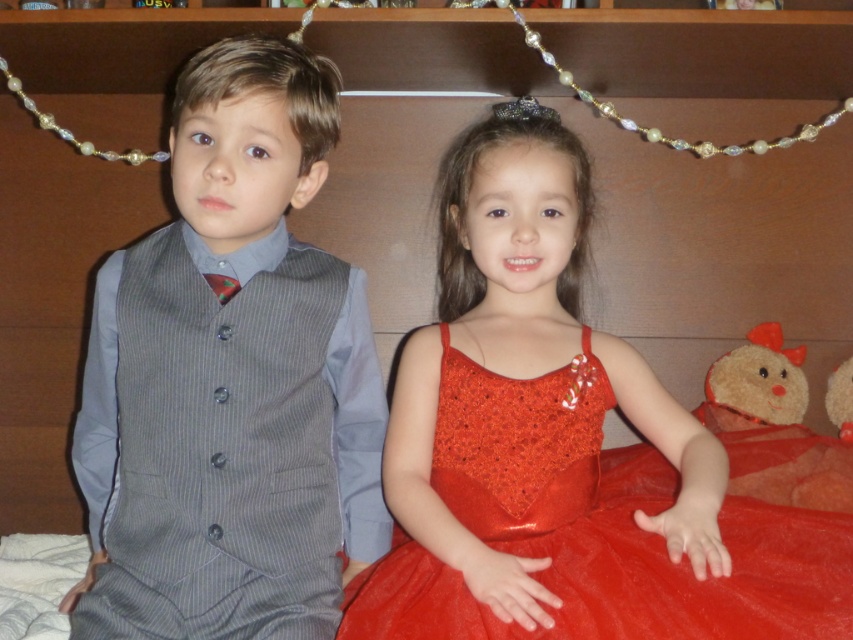
Question: Which point is closer to the camera taking this photo?

Choices:
 (A) (103, 532)
 (B) (779, 422)
 (C) (523, 465)

Answer: (A)

Question: Observing the image, what is the correct spatial positioning of gray pinstripe vest at left in reference to shiny tulle dress at center?

Choices:
 (A) below
 (B) above

Answer: (B)

Question: Is the position of gray pinstripe vest at left less distant than that of fluffy brown teddy bear at lower right?

Choices:
 (A) yes
 (B) no

Answer: (A)

Question: Among these objects, which one is farthest from the camera?

Choices:
 (A) fluffy brown teddy bear at lower right
 (B) shiny tulle dress at center

Answer: (A)

Question: Among these points, which one is nearest to the camera?

Choices:
 (A) (369, 596)
 (B) (207, 262)

Answer: (A)

Question: Does gray pinstripe vest at left lie in front of fluffy brown teddy bear at lower right?

Choices:
 (A) yes
 (B) no

Answer: (A)